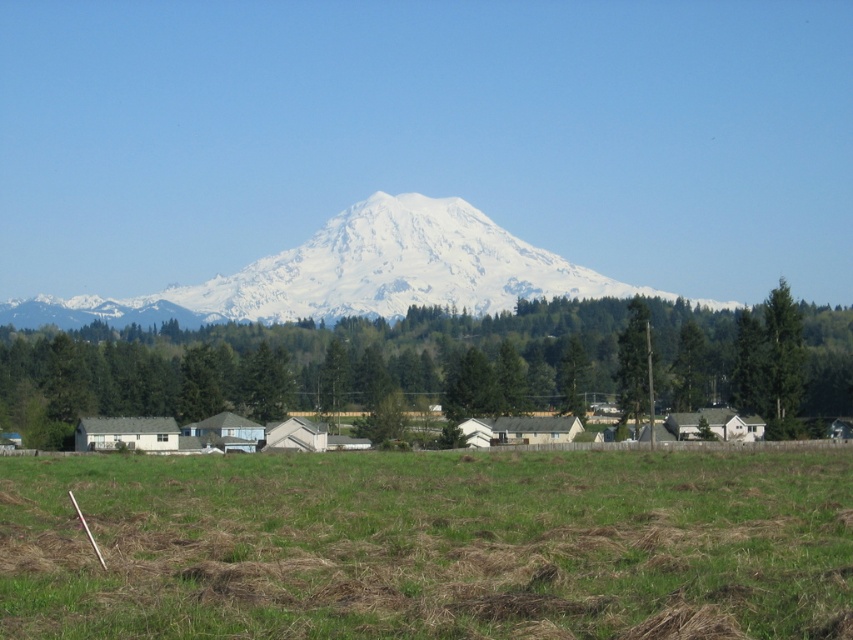
Who is positioned more to the left, green grass at lower center or green textured tree at right?

green grass at lower center

Describe the element at coordinates (428, 545) in the screenshot. This screenshot has width=853, height=640. I see `green grass at lower center` at that location.

Does point (415, 467) come closer to viewer compared to point (642, 374)?

Yes.

This screenshot has height=640, width=853. I want to click on green grass at lower center, so click(x=428, y=545).

Does green textured tree at center have a larger size compared to white snow-covered mountain at center?

Actually, green textured tree at center might be smaller than white snow-covered mountain at center.

How distant is green textured tree at center from white snow-covered mountain at center?

green textured tree at center is 62.85 meters from white snow-covered mountain at center.

Find the location of a particular element. green textured tree at center is located at coordinates (440, 364).

You are a GUI agent. You are given a task and a screenshot of the screen. Output one action in this format:
    pyautogui.click(x=<x>, y=<y>)
    Task: Click on the green textured tree at center
    The image size is (853, 640).
    Given the screenshot: What is the action you would take?
    pyautogui.click(x=440, y=364)

Which of these two, white snow-covered mountain at center or green textured tree at right, stands taller?

white snow-covered mountain at center

Does point (454, 260) come closer to viewer compared to point (630, 346)?

No.

Image resolution: width=853 pixels, height=640 pixels. Find the location of `white snow-covered mountain at center`. white snow-covered mountain at center is located at coordinates 357,275.